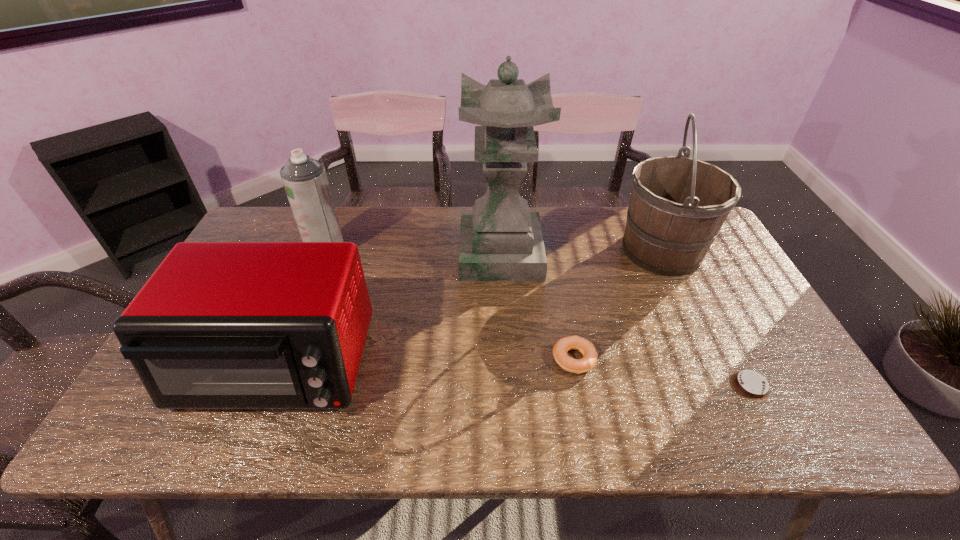
This screenshot has height=540, width=960. In order to click on vacant space located 0.090m on the front of the aerosol can in this screenshot , I will do `click(314, 285)`.

You are a GUI agent. You are given a task and a screenshot of the screen. Output one action in this format:
    pyautogui.click(x=<x>, y=<y>)
    Task: Click on the free location located 0.340m on the left of the bagel
    
    Given the screenshot: What is the action you would take?
    pyautogui.click(x=416, y=359)

Where is `free space located on the right of the shortest object`? This screenshot has height=540, width=960. free space located on the right of the shortest object is located at coordinates (805, 386).

Identify the location of sculpture present at the far edge. Image resolution: width=960 pixels, height=540 pixels. (501, 240).

Find the location of `bucket present at the far edge`. bucket present at the far edge is located at coordinates (678, 205).

Image resolution: width=960 pixels, height=540 pixels. I want to click on aerosol can that is at the far edge, so click(x=305, y=181).

This screenshot has height=540, width=960. What are the coordinates of `object that is at the near edge` in the screenshot? It's located at (219, 325).

This screenshot has width=960, height=540. What are the coordinates of `object at the left edge` in the screenshot? It's located at (219, 325).

Where is `bucket positioned at the right edge`? The height and width of the screenshot is (540, 960). bucket positioned at the right edge is located at coordinates (678, 205).

This screenshot has width=960, height=540. Find the location of `chocolate cake present at the right edge`. chocolate cake present at the right edge is located at coordinates (751, 385).